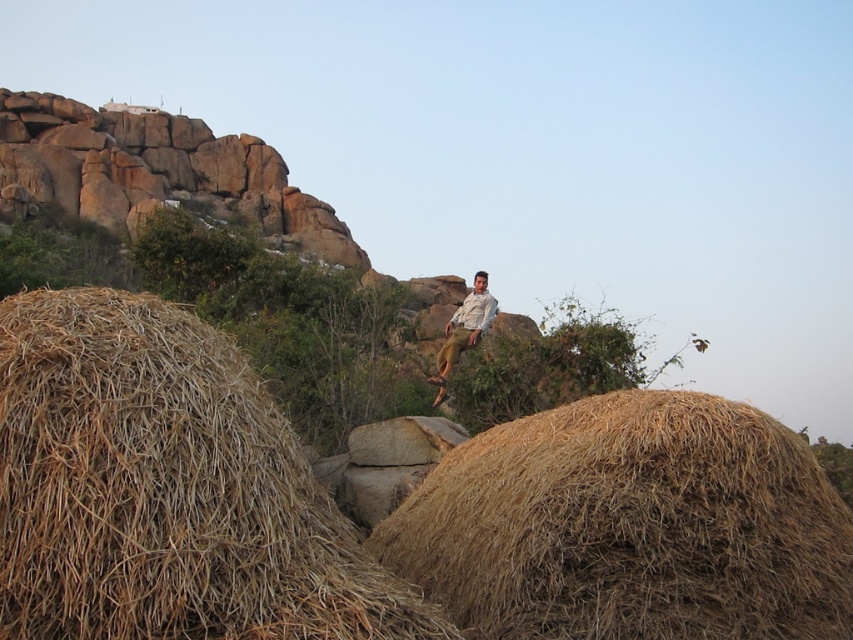
Question: Which point appears farthest from the camera in this image?

Choices:
 (A) (1, 385)
 (B) (566, 572)
 (C) (466, 330)

Answer: (C)

Question: Does brown straw bale at lower left have a lesser width compared to brown straw bale at center?

Choices:
 (A) yes
 (B) no

Answer: (A)

Question: Does brown straw bale at lower left have a greater width compared to light brown shirt at center?

Choices:
 (A) yes
 (B) no

Answer: (A)

Question: Among these points, which one is farthest from the camera?

Choices:
 (A) (643, 532)
 (B) (462, 300)

Answer: (B)

Question: Among these objects, which one is farthest from the camera?

Choices:
 (A) brown straw bale at lower left
 (B) brown straw bale at center
 (C) light brown shirt at center

Answer: (C)

Question: Is the position of brown straw bale at lower left less distant than that of brown straw bale at center?

Choices:
 (A) yes
 (B) no

Answer: (A)